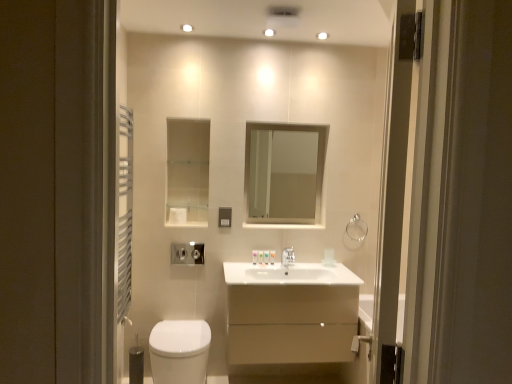
At what (x,y) coordinates should I click in order to perform the action: click on free space in front of translucent plastic toiletries at center, which appears as the 3th toiletry when viewed from the right. Please return your answer as a coordinate pair (x, y). Looking at the image, I should click on (252, 267).